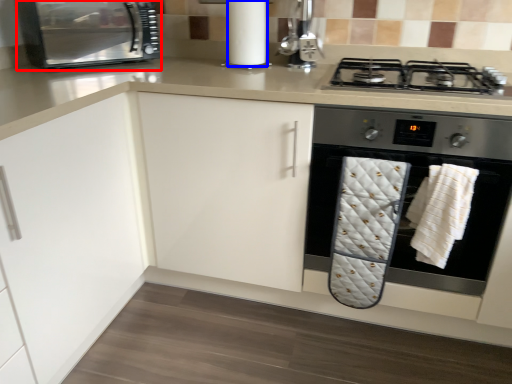
Question: Which object appears closest to the camera in this image, kitchen appliance (highlighted by a red box) or paper towel (highlighted by a blue box)?

Choices:
 (A) kitchen appliance
 (B) paper towel

Answer: (A)